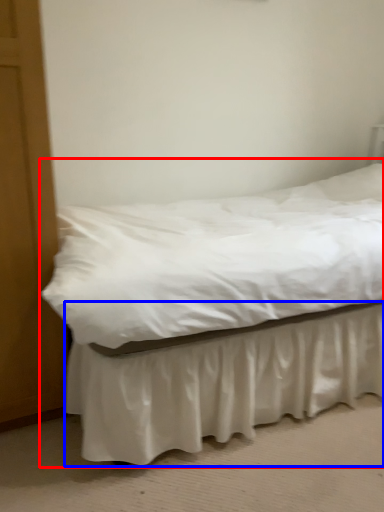
Question: Which object appears farthest to the camera in this image, bed (highlighted by a red box) or bed frame (highlighted by a blue box)?

Choices:
 (A) bed
 (B) bed frame

Answer: (A)